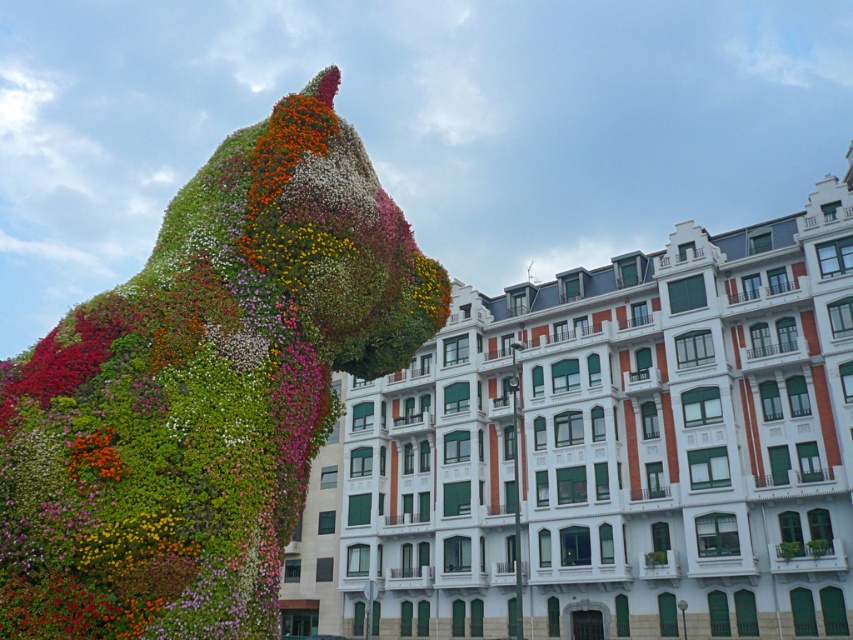
Question: Can you confirm if white stone building at center is thinner than fluffy floral sculpture at upper left?

Choices:
 (A) yes
 (B) no

Answer: (B)

Question: Does white stone building at center appear under fluffy floral sculpture at upper left?

Choices:
 (A) yes
 (B) no

Answer: (A)

Question: Which of the following is the farthest from the observer?

Choices:
 (A) (196, 604)
 (B) (848, 392)

Answer: (B)

Question: Does white stone building at center have a lesser width compared to fluffy floral sculpture at upper left?

Choices:
 (A) yes
 (B) no

Answer: (B)

Question: Which point appears closest to the camera in this image?

Choices:
 (A) (126, 404)
 (B) (556, 316)

Answer: (A)